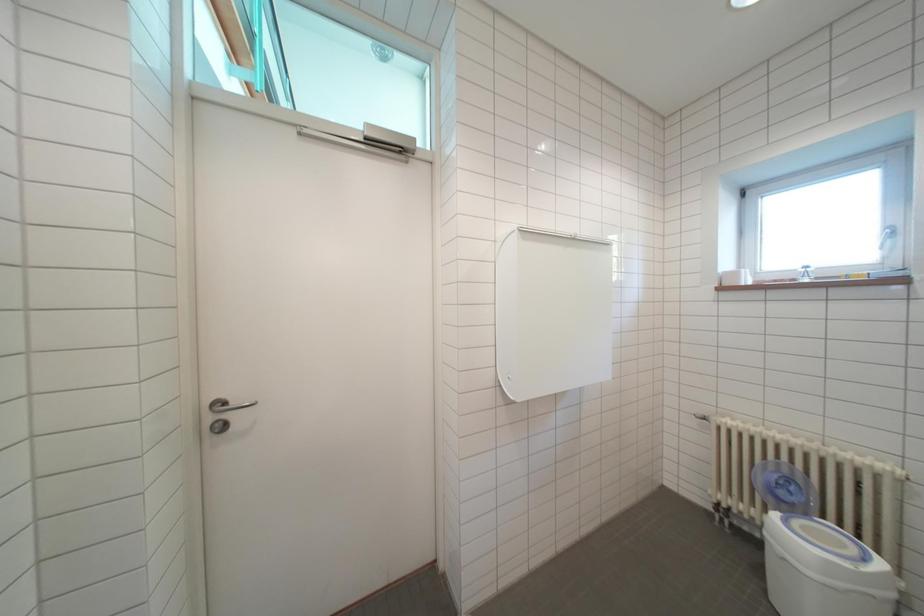
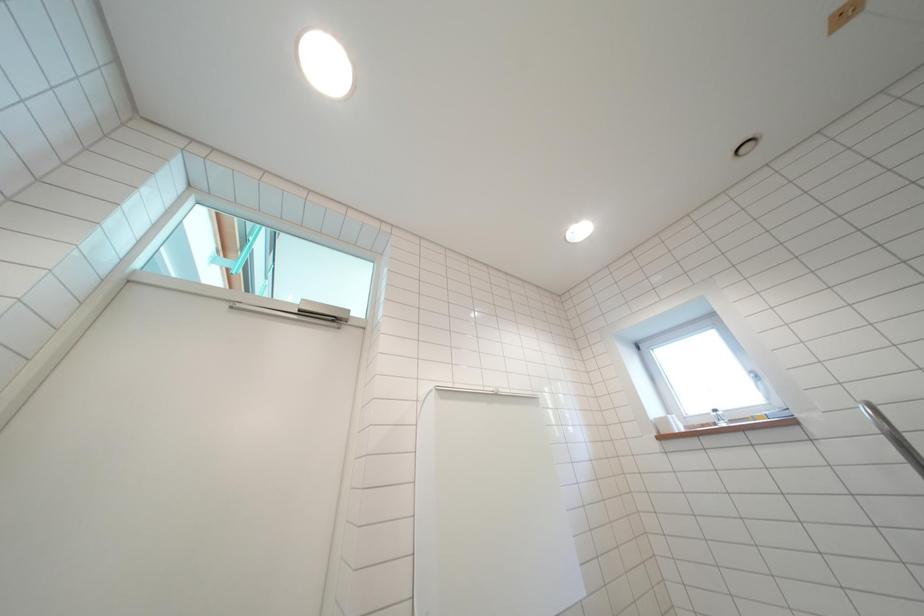
Question: The images are taken continuously from a first-person perspective. In which direction is your viewpoint rotating?

Choices:
 (A) Left
 (B) Right
 (C) Up
 (D) Down

Answer: (C)